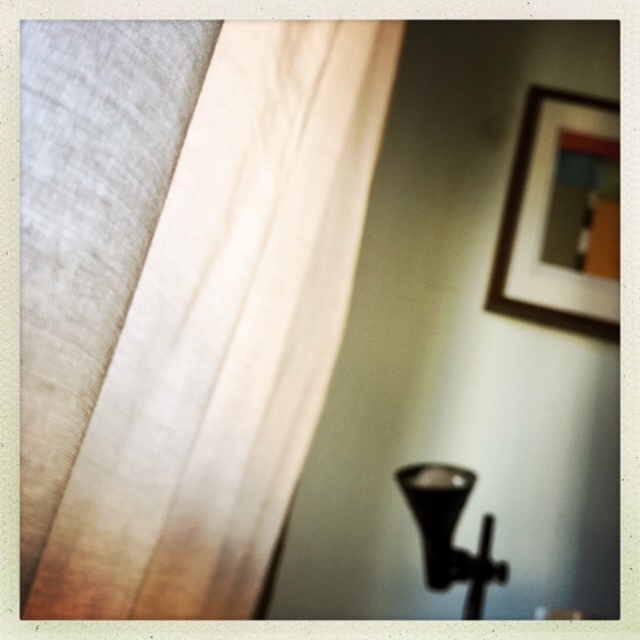
Which of these two, matte white curtain at upper left or wooden framed artwork at upper right, stands shorter?

wooden framed artwork at upper right is shorter.

Can you confirm if matte white curtain at upper left is positioned to the right of wooden framed artwork at upper right?

No, matte white curtain at upper left is not to the right of wooden framed artwork at upper right.

Which is behind, point (74, 557) or point (541, 173)?

The point (541, 173) is behind.

Where is `matte white curtain at upper left`? Image resolution: width=640 pixels, height=640 pixels. matte white curtain at upper left is located at coordinates (227, 332).

Does matte white curtain at upper left come in front of black matte lamp at lower right?

That is True.

Is point (100, 416) farther from viewer compared to point (474, 604)?

That is False.

The width and height of the screenshot is (640, 640). What are the coordinates of `matte white curtain at upper left` in the screenshot? It's located at (227, 332).

Does matte glass window at upper right have a smaller size compared to black matte lamp at lower right?

Correct, matte glass window at upper right occupies less space than black matte lamp at lower right.

Is matte glass window at upper right thinner than black matte lamp at lower right?

Indeed, matte glass window at upper right has a lesser width compared to black matte lamp at lower right.

Which is in front, point (605, 228) or point (467, 497)?

Positioned in front is point (467, 497).

You are a GUI agent. You are given a task and a screenshot of the screen. Output one action in this format:
    pyautogui.click(x=<x>, y=<y>)
    Task: Click on the matte glass window at upper right
    The height and width of the screenshot is (640, 640).
    Given the screenshot: What is the action you would take?
    pyautogui.click(x=584, y=205)